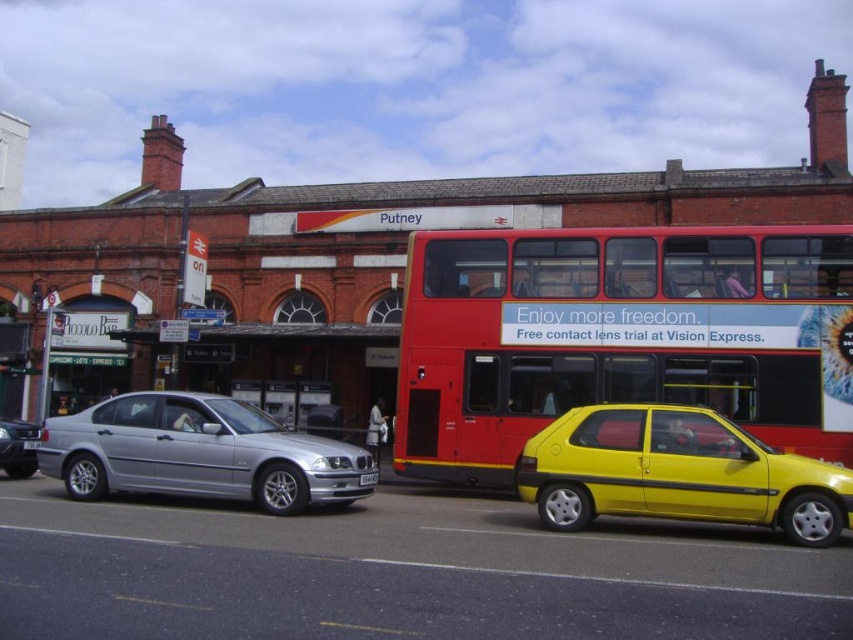
You are a delivery person trying to locate the red matte double decker bus at center. The GPS shows a point at coordinates (619, 337). Where should you look to find the bus?

The point at coordinates (619, 337) corresponds to the red matte double decker bus at center, so you should look there to find the bus.

You are a delivery driver who needs to park your vehicle between the silver metallic sedan at center and the white plastic license plate at center. Given that your delivery van is 2.5 meters wide, can you fit it in the available space?

The silver metallic sedan at center is wider than the white plastic license plate at center. However, the exact width of the space between them isn t specified in the description. Without knowing the distance between the sedan and the license plate, it s impossible to determine if the 2.5 meter wide delivery van will fit.

You are a delivery person who needs to park your van between the silver metallic sedan at center and the white plastic license plate at center. The van is 6 meters long. Is there enough space between them?

The silver metallic sedan at center is 10.72 meters away from the white plastic license plate at center. Since the van is only 6 meters long, there is sufficient space between them to park the van.